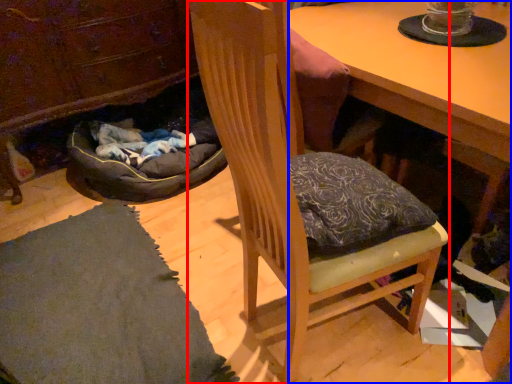
Question: Which object appears farthest to the camera in this image, chair (highlighted by a red box) or desk (highlighted by a blue box)?

Choices:
 (A) chair
 (B) desk

Answer: (B)